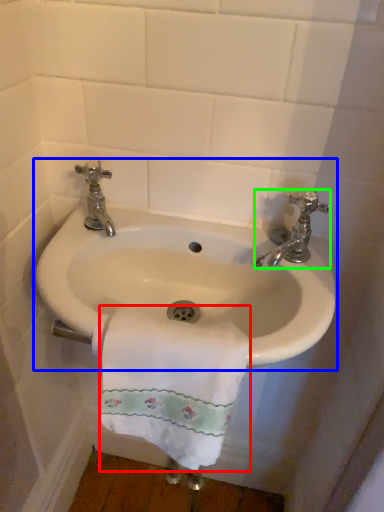
Question: Which object is positioned farthest from towel/napkin (highlighted by a red box)? Select from sink (highlighted by a blue box) and tap (highlighted by a green box).

Choices:
 (A) sink
 (B) tap

Answer: (B)